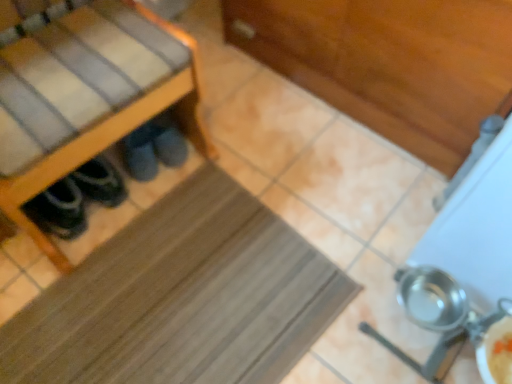
The width and height of the screenshot is (512, 384). I want to click on free spot behind brown rubber mat at center, so click(261, 143).